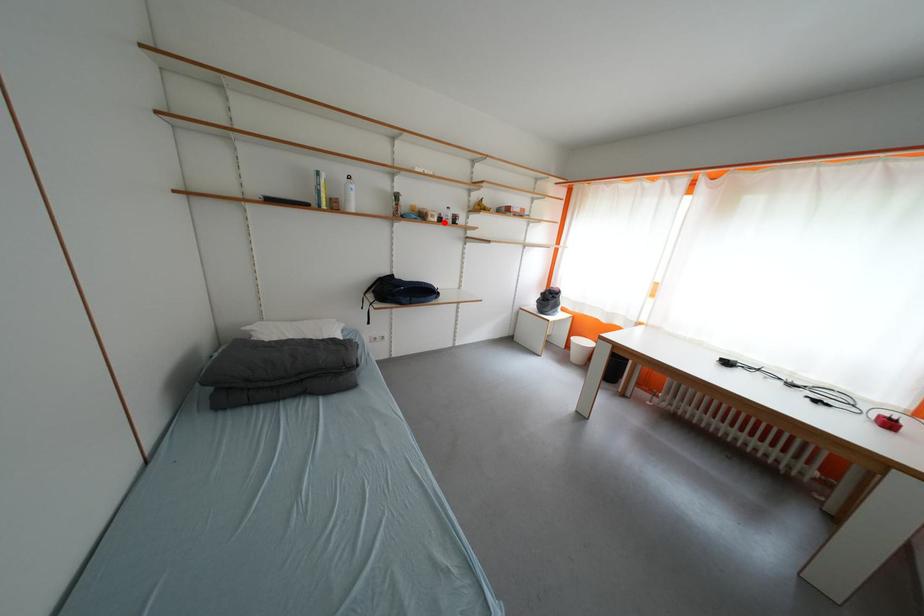
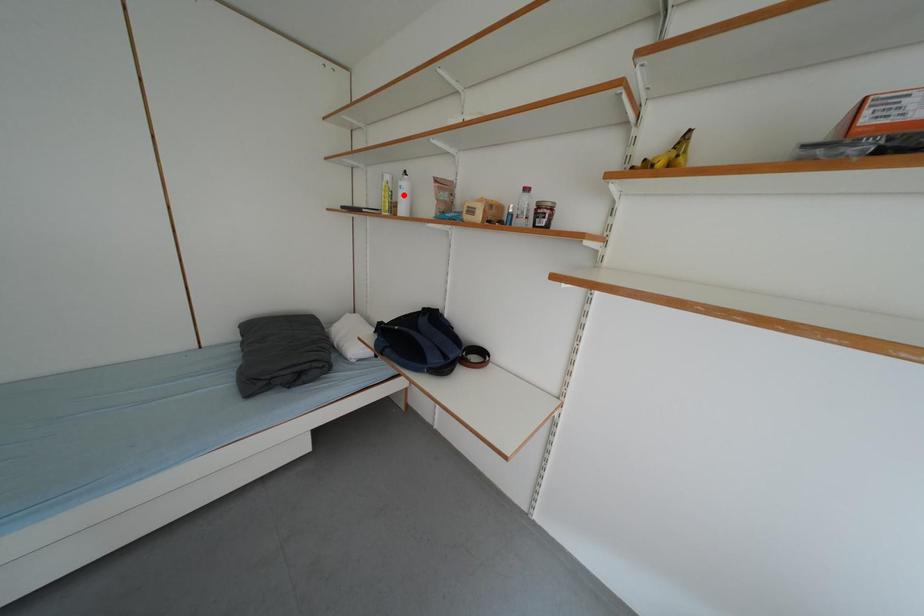
I am providing you with two images of the same scene from different viewpoints. A red point is marked on the first image and another point is marked on the second image. Do the highlighted points in image1 and image2 indicate the same real-world spot?

No